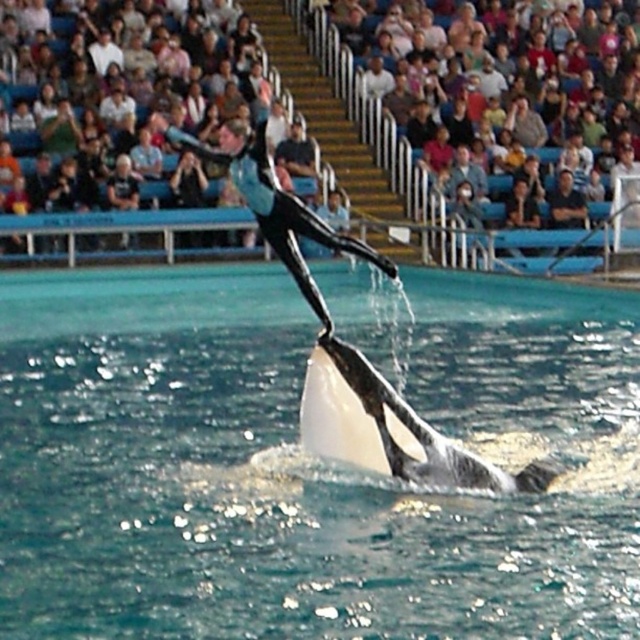
Question: Is clear blue water at center below black smooth whale at center?

Choices:
 (A) no
 (B) yes

Answer: (A)

Question: Which is farther from the multicolored fabric crowd at upper center?

Choices:
 (A) black smooth whale at center
 (B) clear blue water at center

Answer: (A)

Question: Where is clear blue water at center located in relation to black smooth whale at center in the image?

Choices:
 (A) below
 (B) above

Answer: (B)

Question: Which point is closer to the camera taking this photo?

Choices:
 (A) (144, 618)
 (B) (60, 156)

Answer: (A)

Question: Can you confirm if clear blue water at center is bigger than multicolored fabric crowd at upper center?

Choices:
 (A) yes
 (B) no

Answer: (B)

Question: Among these points, which one is farthest from the camera?

Choices:
 (A) (296, 74)
 (B) (595, 289)
 (C) (371, 392)

Answer: (A)